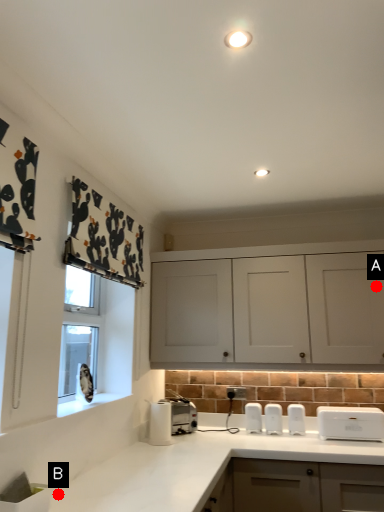
Question: Two points are circled on the image, labeled by A and B beside each circle. Which point appears closest to the camera in this image?

Choices:
 (A) A is closer
 (B) B is closer

Answer: (B)